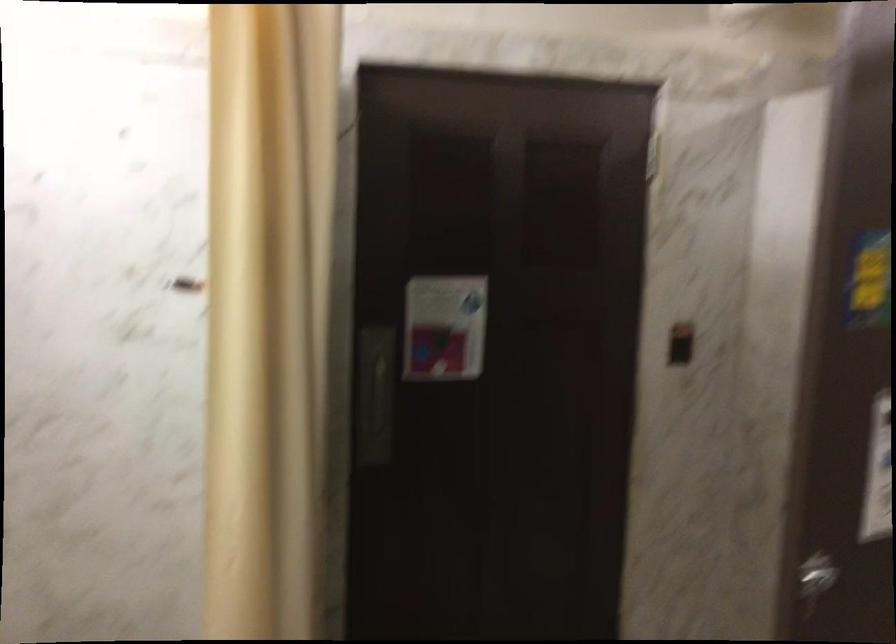
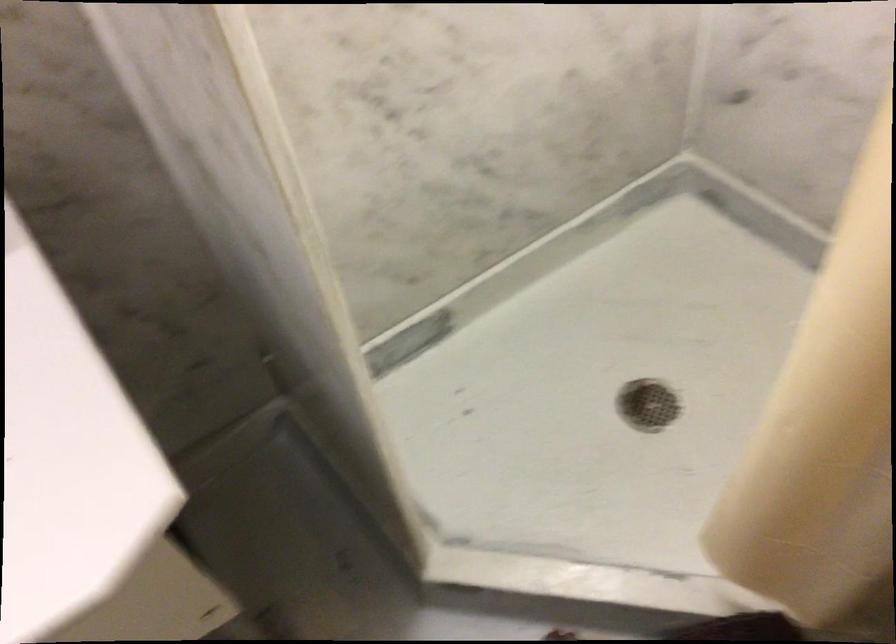
The images are taken continuously from a first-person perspective. In which direction is your viewpoint rotating?

The camera rotated toward left-down.